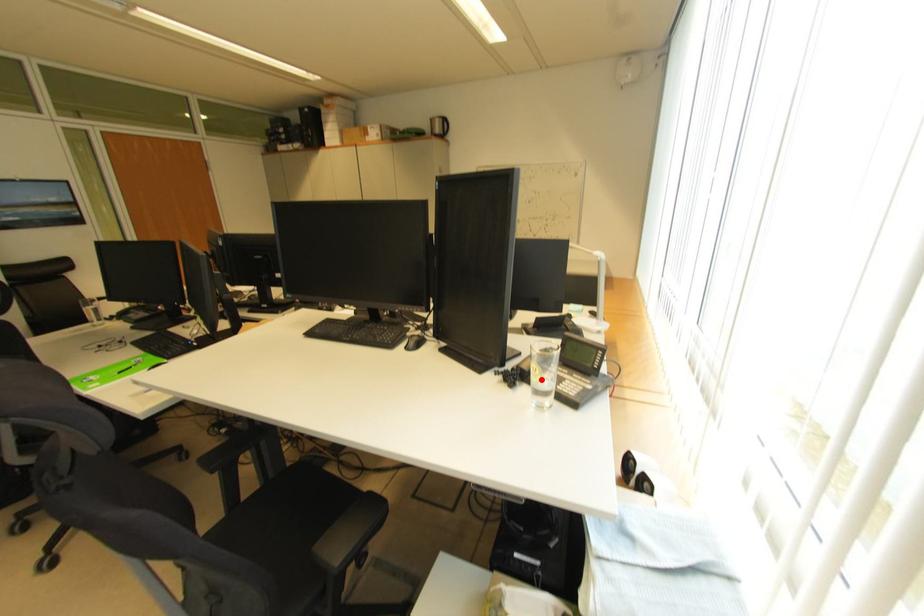
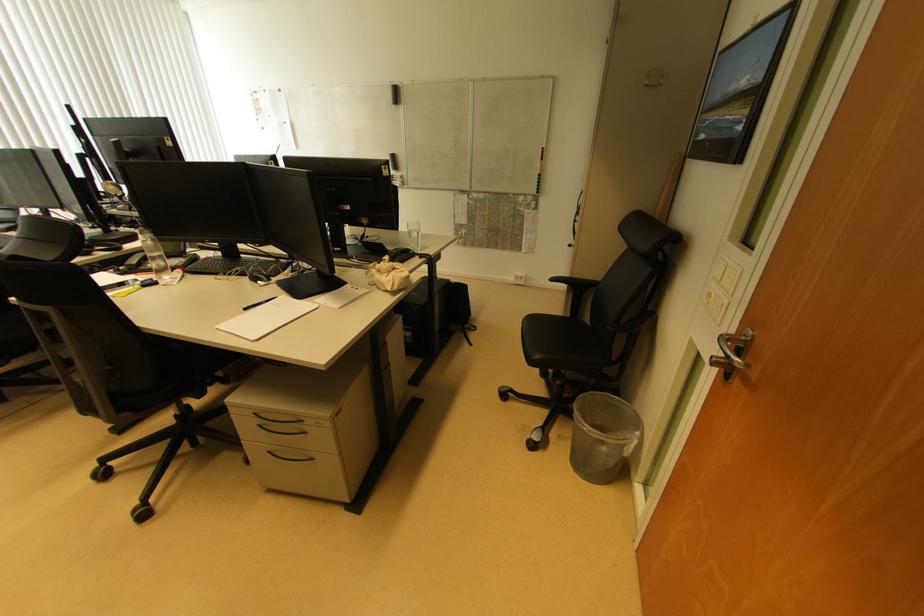
Question: I am providing you with two images of the same scene from different viewpoints. A red point is marked on the first image. Can you still see the location of the red point in image 2?

Choices:
 (A) Yes
 (B) No

Answer: (B)